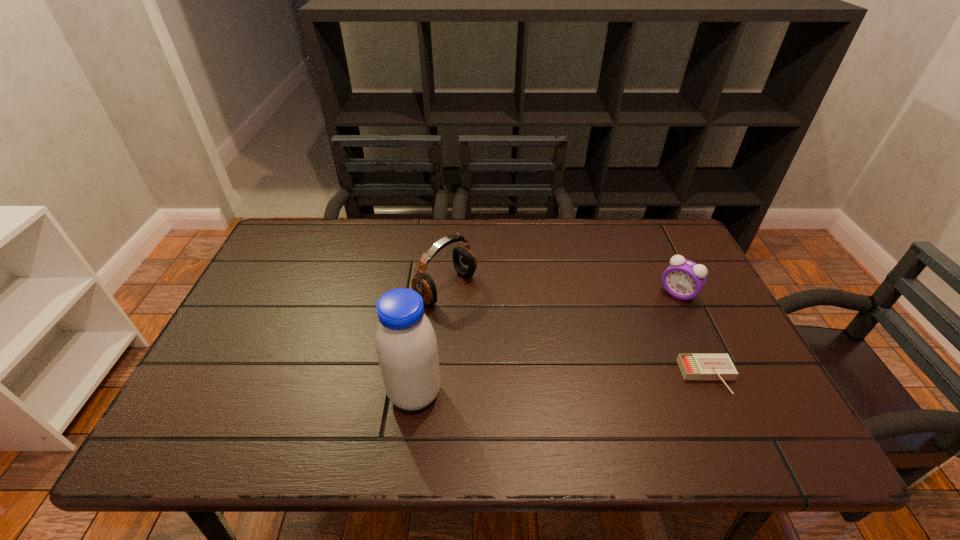
Point out which object is positioned as the nearest to the third tallest object. Please provide its 2D coordinates. Your answer should be formatted as a tuple, i.e. [(x, y)], where the tuple contains the x and y coordinates of a point satisfying the conditions above.

[(692, 366)]

Where is `object that is the second nearest to the tallest object`? object that is the second nearest to the tallest object is located at coordinates (692, 366).

The height and width of the screenshot is (540, 960). What are the coordinates of `free space in the image that satisfies the following two spatial constraints: 1. on the front side of the alarm clock; 2. on the left side of the second tallest object` in the screenshot? It's located at (445, 293).